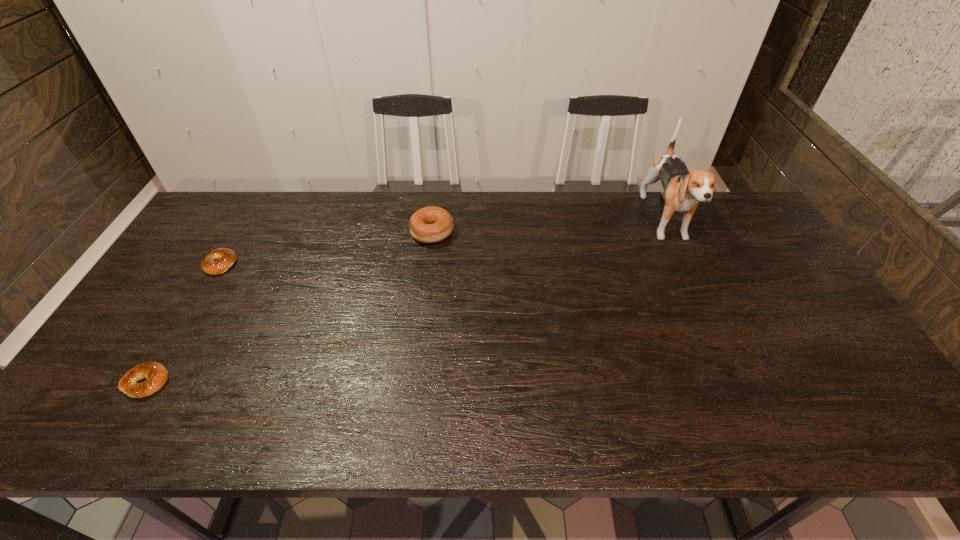
This screenshot has width=960, height=540. I want to click on puppy that is at the far edge, so click(682, 190).

The height and width of the screenshot is (540, 960). In order to click on bagel located at the far edge in this screenshot , I will do `click(432, 224)`.

I want to click on free space at the far edge of the desktop, so click(x=352, y=194).

In the image, there is a desktop. Identify the location of vacant space at the near edge. (562, 417).

Identify the location of blank space at the left edge. This screenshot has height=540, width=960. (231, 242).

Where is `vacant region at the right edge of the desktop`? This screenshot has width=960, height=540. vacant region at the right edge of the desktop is located at coordinates (743, 245).

The width and height of the screenshot is (960, 540). What are the coordinates of `vacant space at the near left corner of the desktop` in the screenshot? It's located at (90, 440).

In the image, there is a desktop. Identify the location of free space at the far right corner. The image size is (960, 540). (748, 228).

Where is `vacant region between the second nearest bagel and the puppy`? Image resolution: width=960 pixels, height=540 pixels. vacant region between the second nearest bagel and the puppy is located at coordinates pyautogui.click(x=444, y=243).

You are a GUI agent. You are given a task and a screenshot of the screen. Output one action in this format:
    pyautogui.click(x=<x>, y=<y>)
    Task: Click on the vacant space that's between the tallest object and the rightmost bagel
    This screenshot has height=540, width=960.
    Given the screenshot: What is the action you would take?
    pyautogui.click(x=549, y=227)